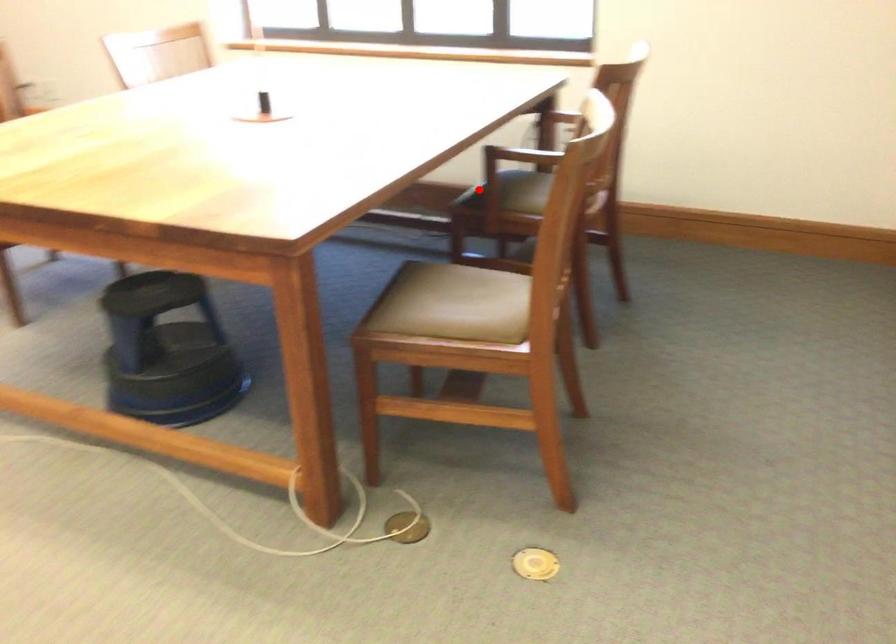
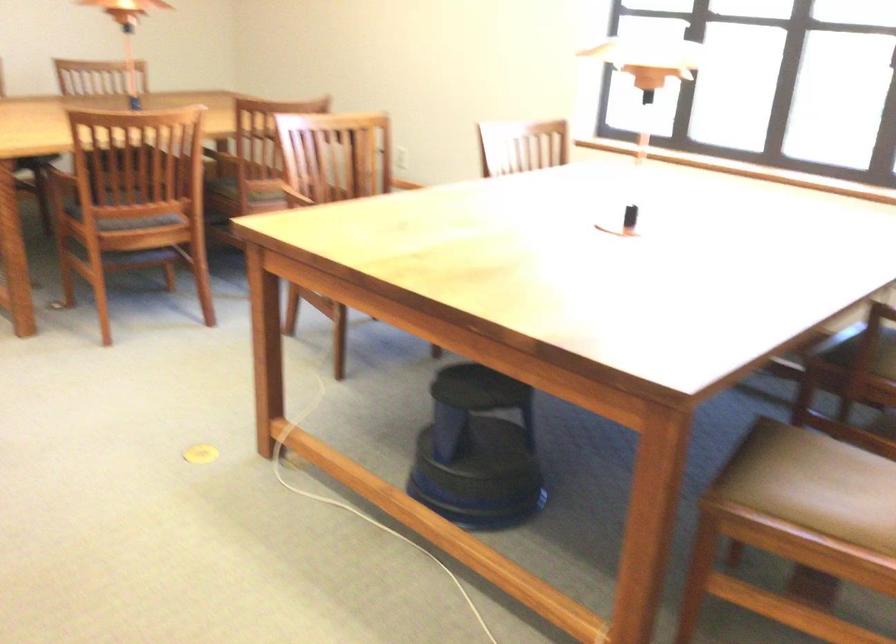
Question: I am providing you with two images of the same scene from different viewpoints. A red point is marked on the first image. At the location where the point appears in image 1, is it still visible in image 2?

Choices:
 (A) Yes
 (B) No

Answer: (A)